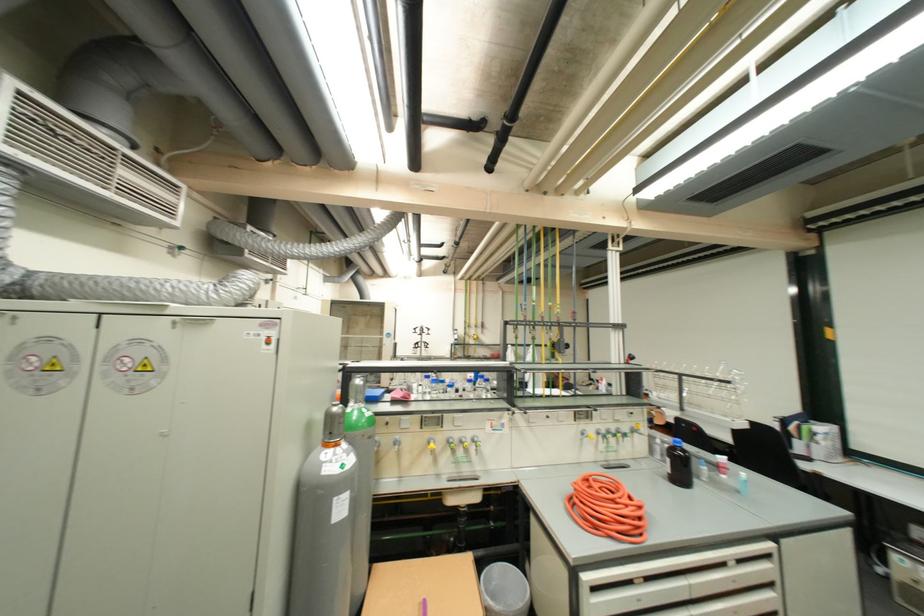
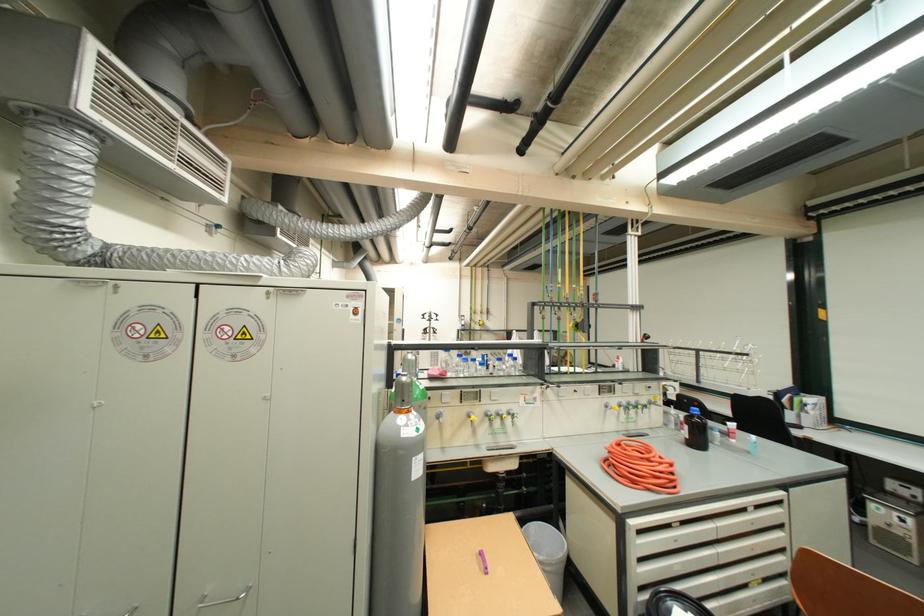
Question: In a continuous first-person perspective shot, in which direction is the camera moving?

Choices:
 (A) Left
 (B) Right
 (C) Forward
 (D) Backward

Answer: (A)